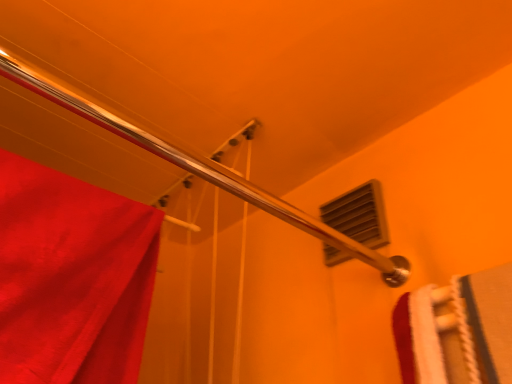
This screenshot has width=512, height=384. In order to click on shiny metallic shower at upper left in this screenshot , I will do `click(204, 170)`.

What do you see at coordinates (204, 170) in the screenshot? This screenshot has height=384, width=512. I see `shiny metallic shower at upper left` at bounding box center [204, 170].

Based on the photo, measure the distance between point (309, 229) and camera.

Point (309, 229) and camera are 82.30 centimeters apart from each other.

The width and height of the screenshot is (512, 384). Describe the element at coordinates (359, 215) in the screenshot. I see `matte plastic vent at upper right` at that location.

What is the approximate width of matte plastic vent at upper right?

matte plastic vent at upper right is 1.18 inches in width.

Locate an element on the screen. matte plastic vent at upper right is located at coordinates click(x=359, y=215).

Find the location of a particular element. The height and width of the screenshot is (384, 512). shiny metallic shower at upper left is located at coordinates (204, 170).

Consider the image. Between matte plastic vent at upper right and shiny metallic shower at upper left, which one appears on the left side from the viewer's perspective?

Positioned to the left is shiny metallic shower at upper left.

Does matte plastic vent at upper right lie behind shiny metallic shower at upper left?

Yes, it is.

Is point (369, 206) more distant than point (197, 166)?

Yes, it is behind point (197, 166).

From the image's perspective, is matte plastic vent at upper right located above or below shiny metallic shower at upper left?

From the image's perspective, matte plastic vent at upper right appears below shiny metallic shower at upper left.

From a real-world perspective, is matte plastic vent at upper right positioned above or below shiny metallic shower at upper left?

matte plastic vent at upper right is situated lower than shiny metallic shower at upper left in the real world.

Which object is thinner, matte plastic vent at upper right or shiny metallic shower at upper left?

With smaller width is matte plastic vent at upper right.

From their relative heights in the image, would you say matte plastic vent at upper right is taller or shorter than shiny metallic shower at upper left?

In the image, matte plastic vent at upper right appears to be taller than shiny metallic shower at upper left.

Can you confirm if matte plastic vent at upper right is smaller than shiny metallic shower at upper left?

Yes, matte plastic vent at upper right is smaller than shiny metallic shower at upper left.

Is matte plastic vent at upper right located outside shiny metallic shower at upper left?

Yes, matte plastic vent at upper right is located beyond the bounds of shiny metallic shower at upper left.

Can you see matte plastic vent at upper right touching shiny metallic shower at upper left?

No, matte plastic vent at upper right is not touching shiny metallic shower at upper left.

Consider the image. Is matte plastic vent at upper right looking in the opposite direction of shiny metallic shower at upper left?

No, matte plastic vent at upper right is not facing the opposite direction of shiny metallic shower at upper left.

Measure the distance from matte plastic vent at upper right to shiny metallic shower at upper left.

A distance of 18.24 centimeters exists between matte plastic vent at upper right and shiny metallic shower at upper left.

Locate an element on the screen. The width and height of the screenshot is (512, 384). shower above the matte plastic vent at upper right (from the image's perspective) is located at coordinates click(204, 170).

Considering the positions of objects shiny metallic shower at upper left and matte plastic vent at upper right in the image provided, who is more to the left, shiny metallic shower at upper left or matte plastic vent at upper right?

shiny metallic shower at upper left.

Is shiny metallic shower at upper left in front of or behind matte plastic vent at upper right in the image?

Result: shiny metallic shower at upper left is in front of matte plastic vent at upper right.

Does point (152, 142) lie behind point (354, 237)?

No, (152, 142) is closer to viewer.

From the image's perspective, is shiny metallic shower at upper left above or below matte plastic vent at upper right?

Clearly, from the image's perspective, shiny metallic shower at upper left is above matte plastic vent at upper right.

From a real-world perspective, is shiny metallic shower at upper left above or below matte plastic vent at upper right?

Clearly, from a real-world perspective, shiny metallic shower at upper left is above matte plastic vent at upper right.

Considering the relative sizes of shiny metallic shower at upper left and matte plastic vent at upper right in the image provided, is shiny metallic shower at upper left wider than matte plastic vent at upper right?

Yes, shiny metallic shower at upper left is wider than matte plastic vent at upper right.

Is shiny metallic shower at upper left taller than matte plastic vent at upper right?

No, shiny metallic shower at upper left is not taller than matte plastic vent at upper right.

Does shiny metallic shower at upper left have a larger size compared to matte plastic vent at upper right?

Yes.

Is shiny metallic shower at upper left spatially inside matte plastic vent at upper right, or outside of it?

shiny metallic shower at upper left is spatially situated outside matte plastic vent at upper right.

Consider the image. Is there a large distance between shiny metallic shower at upper left and matte plastic vent at upper right?

shiny metallic shower at upper left is actually quite close to matte plastic vent at upper right.

Is matte plastic vent at upper right at the back of shiny metallic shower at upper left?

No, shiny metallic shower at upper left is not facing the opposite direction of matte plastic vent at upper right.

What's the angular difference between shiny metallic shower at upper left and matte plastic vent at upper right's facing directions?

There is a 90-degree angle between the facing directions of shiny metallic shower at upper left and matte plastic vent at upper right.

How much distance is there between shiny metallic shower at upper left and matte plastic vent at upper right?

shiny metallic shower at upper left and matte plastic vent at upper right are 7.18 inches apart.

The image size is (512, 384). Identify the location of window located on the right of shiny metallic shower at upper left. (359, 215).

At what (x,y) coordinates should I click in order to perform the action: click on shower lying above the matte plastic vent at upper right (from the image's perspective). Please return your answer as a coordinate pair (x, y). Image resolution: width=512 pixels, height=384 pixels. Looking at the image, I should click on (204, 170).

At what (x,y) coordinates should I click in order to perform the action: click on window beneath the shiny metallic shower at upper left (from a real-world perspective). Please return your answer as a coordinate pair (x, y). The width and height of the screenshot is (512, 384). Looking at the image, I should click on (359, 215).